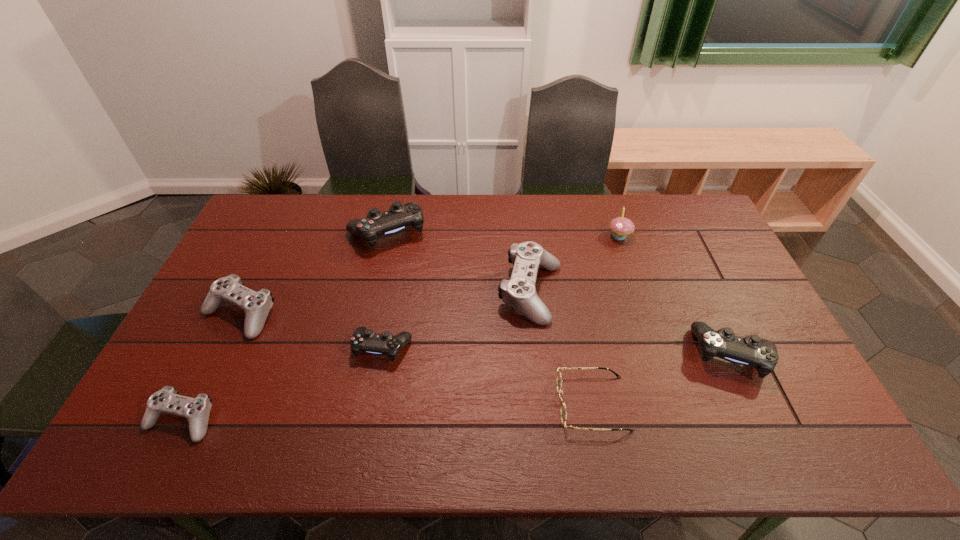
Where is `cupcake`? The image size is (960, 540). cupcake is located at coordinates (620, 226).

Find the location of `pink cupcake`. pink cupcake is located at coordinates (620, 226).

Where is `the tallest control`? The image size is (960, 540). the tallest control is located at coordinates (399, 217).

In order to click on the farthest black control in this screenshot , I will do `click(399, 217)`.

Where is `the biggest white control`? the biggest white control is located at coordinates (519, 292).

Locate an element on the screen. The image size is (960, 540). the rightmost white control is located at coordinates (519, 292).

Image resolution: width=960 pixels, height=540 pixels. I want to click on the rightmost object, so click(752, 351).

This screenshot has width=960, height=540. Find the location of `the rightmost control`. the rightmost control is located at coordinates (752, 351).

Where is `the second smallest white control`? Image resolution: width=960 pixels, height=540 pixels. the second smallest white control is located at coordinates (256, 305).

Where is `the smallest black control`? The width and height of the screenshot is (960, 540). the smallest black control is located at coordinates (366, 340).